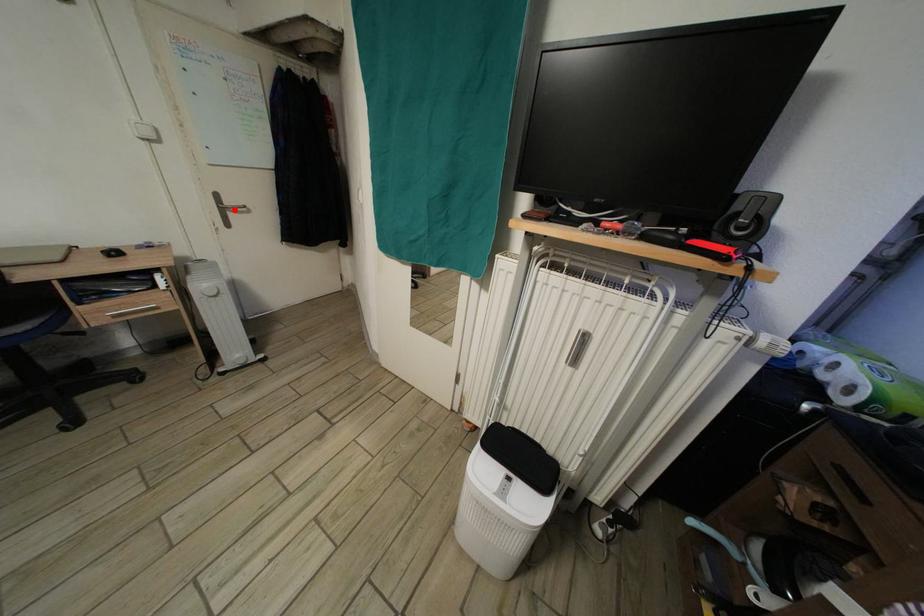
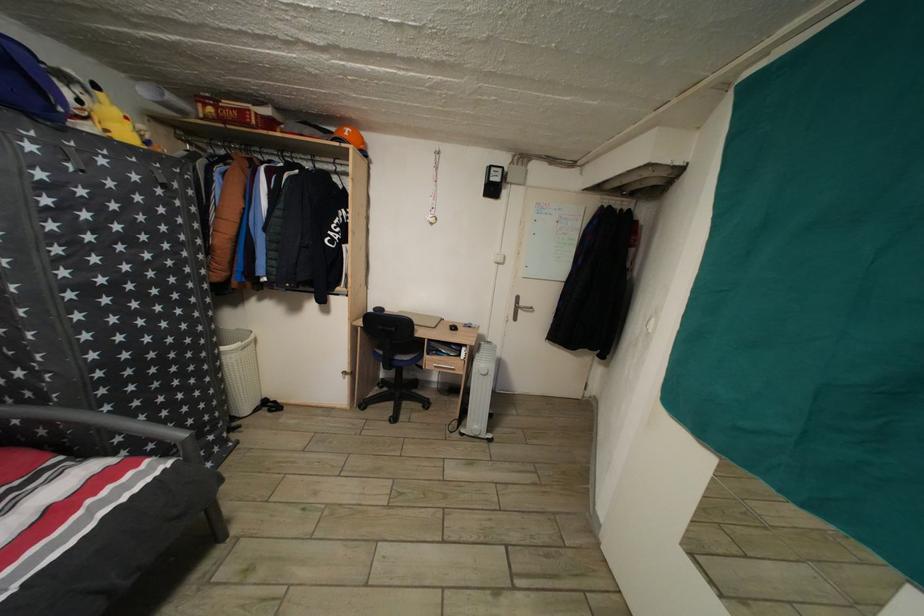
Question: I am providing you with two images of the same scene from different viewpoints. A red point is marked on the first image. Is the red point's position out of view in image 2?

Choices:
 (A) Yes
 (B) No

Answer: (B)